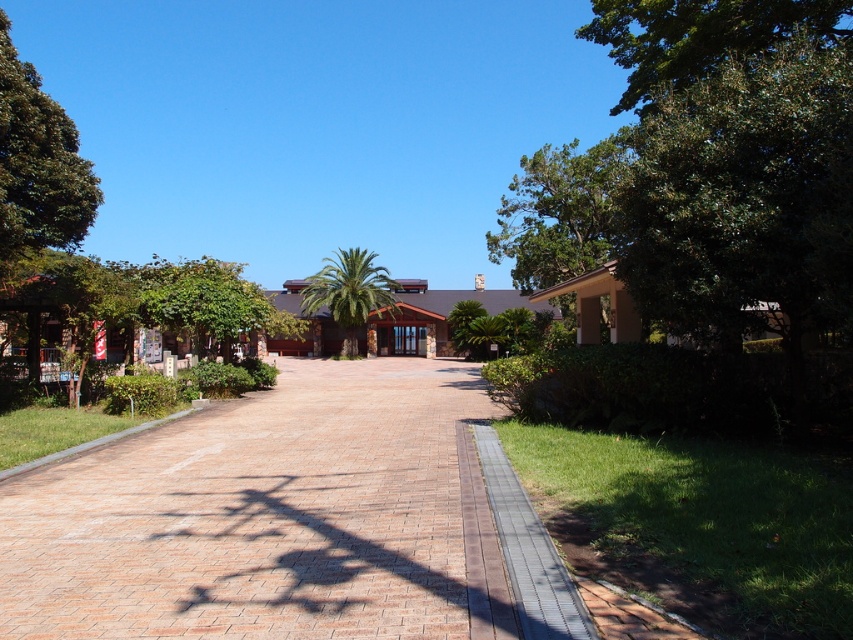
Question: Estimate the real-world distances between objects in this image. Which object is farther from the green leafy tree at center?

Choices:
 (A) green leafy tree at upper left
 (B) green leafy tree at right
 (C) green leafy palm at center

Answer: (A)

Question: Does green leafy tree at upper left appear on the right side of green leafy palm at center?

Choices:
 (A) no
 (B) yes

Answer: (B)

Question: Which point is farther to the camera?

Choices:
 (A) (776, 148)
 (B) (62, 144)
 (C) (329, 282)
 (D) (466, 316)

Answer: (C)

Question: Among these objects, which one is nearest to the camera?

Choices:
 (A) green leafy palm at center
 (B) green leafy tree at center
 (C) green leafy tree at upper left

Answer: (C)

Question: Is green leafy tree at upper left to the right of green leafy palm at center from the viewer's perspective?

Choices:
 (A) no
 (B) yes

Answer: (B)

Question: Does green leafy palm at center appear under green leafy tree at center?

Choices:
 (A) no
 (B) yes

Answer: (A)